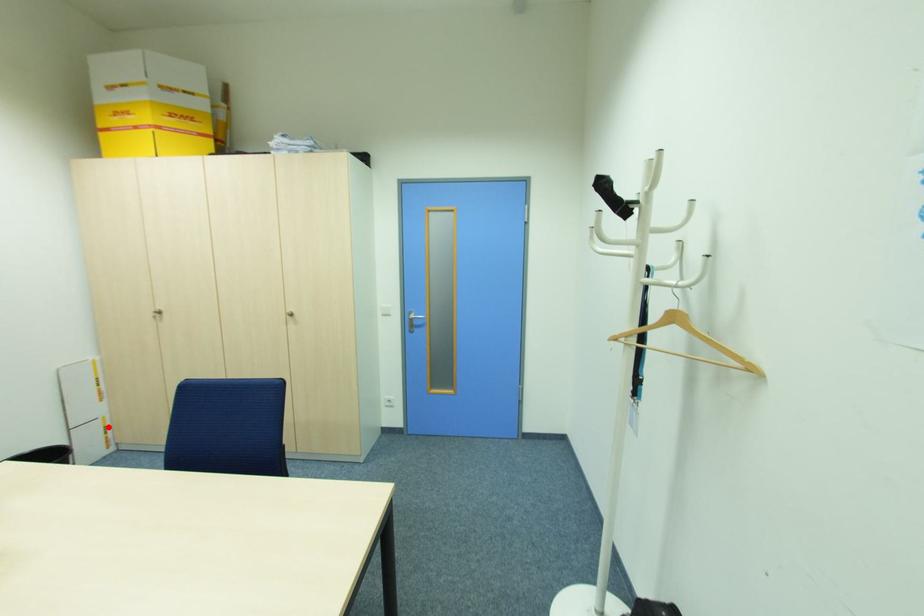
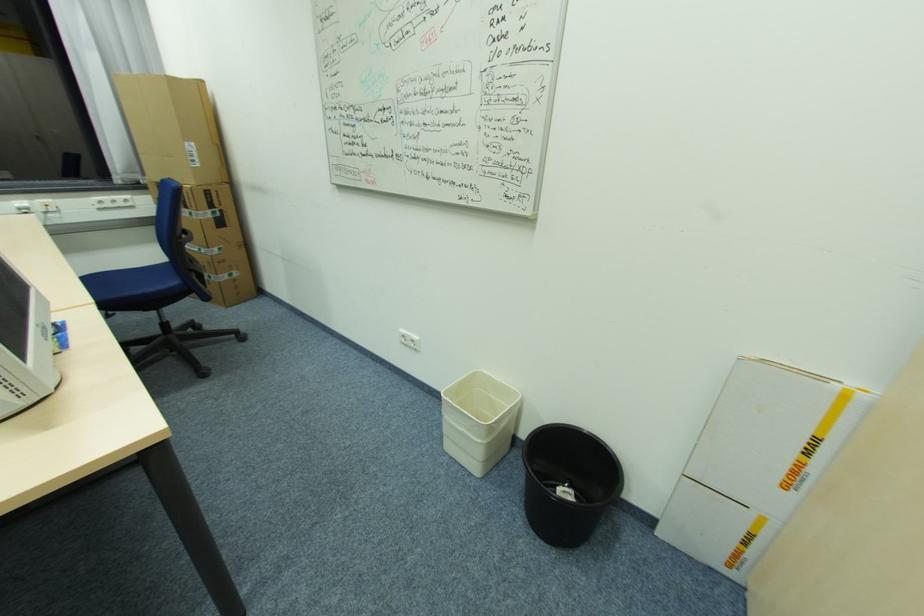
In the second image, find the point that corresponds to the highlighted location in the first image.

(752, 535)